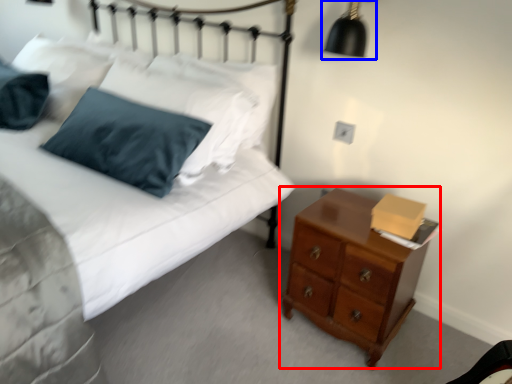
Question: Among these objects, which one is nearest to the camera, chest of drawers (highlighted by a red box) or lamp (highlighted by a blue box)?

Choices:
 (A) chest of drawers
 (B) lamp

Answer: (A)